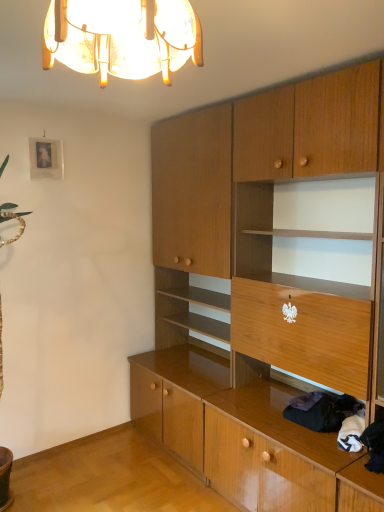
Question: Considering the relative positions of wooden cabinet at center and dark woolen sweater at lower right in the image provided, is wooden cabinet at center behind dark woolen sweater at lower right?

Choices:
 (A) yes
 (B) no

Answer: (B)

Question: Is wooden cabinet at center aimed at dark woolen sweater at lower right?

Choices:
 (A) yes
 (B) no

Answer: (A)

Question: From a real-world perspective, is wooden cabinet at center physically above dark woolen sweater at lower right?

Choices:
 (A) no
 (B) yes

Answer: (B)

Question: Does wooden cabinet at center have a lesser width compared to dark woolen sweater at lower right?

Choices:
 (A) yes
 (B) no

Answer: (B)

Question: From a real-world perspective, is wooden cabinet at center beneath dark woolen sweater at lower right?

Choices:
 (A) yes
 (B) no

Answer: (B)

Question: Can you confirm if wooden cabinet at center is shorter than dark woolen sweater at lower right?

Choices:
 (A) yes
 (B) no

Answer: (B)

Question: Considering the relative sizes of translucent glass chandelier at upper center and dark woolen sweater at lower right in the image provided, is translucent glass chandelier at upper center taller than dark woolen sweater at lower right?

Choices:
 (A) no
 (B) yes

Answer: (B)

Question: Can you confirm if translucent glass chandelier at upper center is positioned to the right of dark woolen sweater at lower right?

Choices:
 (A) no
 (B) yes

Answer: (A)

Question: From the image's perspective, is translucent glass chandelier at upper center beneath dark woolen sweater at lower right?

Choices:
 (A) no
 (B) yes

Answer: (A)

Question: Does translucent glass chandelier at upper center touch dark woolen sweater at lower right?

Choices:
 (A) yes
 (B) no

Answer: (B)

Question: Is translucent glass chandelier at upper center further to camera compared to dark woolen sweater at lower right?

Choices:
 (A) yes
 (B) no

Answer: (B)

Question: Can you confirm if translucent glass chandelier at upper center is smaller than dark woolen sweater at lower right?

Choices:
 (A) yes
 (B) no

Answer: (B)

Question: Considering the relative sizes of translucent glass chandelier at upper center and wooden cabinet at center in the image provided, is translucent glass chandelier at upper center thinner than wooden cabinet at center?

Choices:
 (A) yes
 (B) no

Answer: (A)